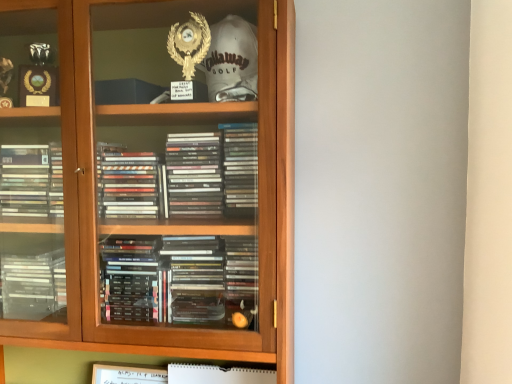
What is the approximate height of wooden bookcase at center?

1.00 meters.

The width and height of the screenshot is (512, 384). Describe the element at coordinates (147, 188) in the screenshot. I see `wooden bookcase at center` at that location.

Measure the distance between point [243,330] and camera.

Point [243,330] and camera are 33.31 inches apart from each other.

You are a GUI agent. You are given a task and a screenshot of the screen. Output one action in this format:
    pyautogui.click(x=<x>, y=<y>)
    Task: Click on the wooden bookcase at center
    
    Given the screenshot: What is the action you would take?
    pyautogui.click(x=147, y=188)

Identify the location of wooden bookcase at center. (147, 188).